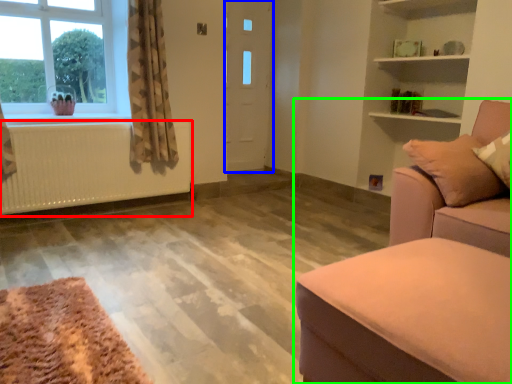
Question: Based on their relative distances, which object is nearer to radiator (highlighted by a red box)? Choose from door (highlighted by a blue box) and studio couch (highlighted by a green box).

Choices:
 (A) door
 (B) studio couch

Answer: (A)